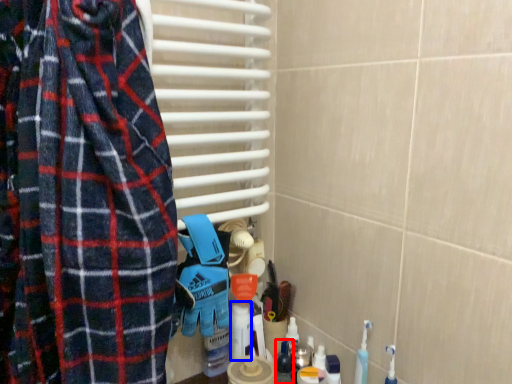
Question: Which point is closer to the camera, toiletry (highlighted by a red box) or cleaning product (highlighted by a blue box)?

Choices:
 (A) toiletry
 (B) cleaning product

Answer: (A)